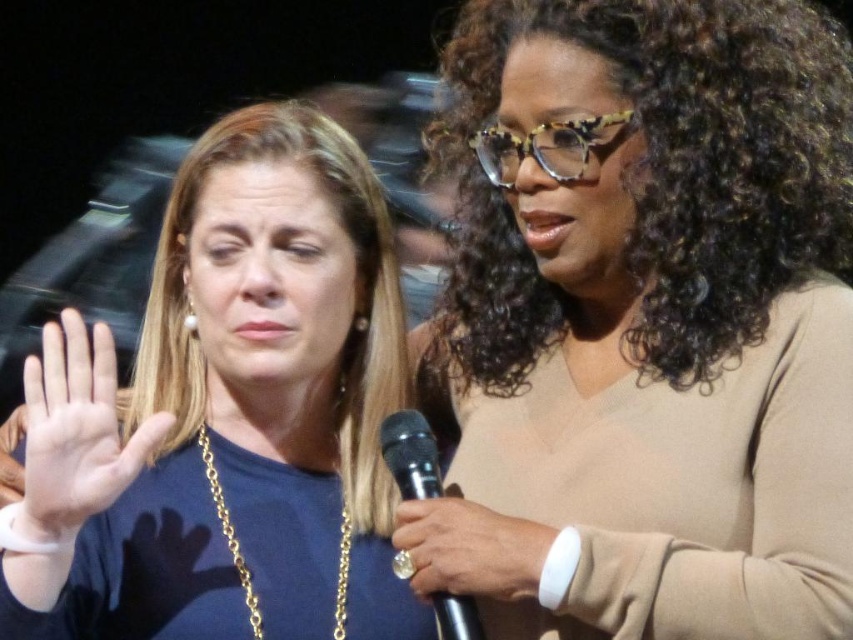
Question: Which object is positioned farthest from the pale skin palm at center?

Choices:
 (A) brown matte sweater at upper right
 (B) black metallic microphone at center
 (C) blue fabric shirt at left
 (D) white leather wristband at upper right

Answer: (A)

Question: Can you confirm if blue fabric shirt at left is positioned to the left of black metallic microphone at center?

Choices:
 (A) no
 (B) yes

Answer: (B)

Question: Which point appears farthest from the camera in this image?

Choices:
 (A) (399, 440)
 (B) (111, 420)
 (C) (611, 77)
 (D) (41, 540)

Answer: (A)

Question: Is brown matte sweater at upper right further to the viewer compared to blue fabric shirt at left?

Choices:
 (A) yes
 (B) no

Answer: (B)

Question: Is blue fabric shirt at left further to the viewer compared to black metallic microphone at center?

Choices:
 (A) no
 (B) yes

Answer: (A)

Question: Which of the following is the farthest from the observer?

Choices:
 (A) brown matte sweater at upper right
 (B) black metallic microphone at center

Answer: (B)